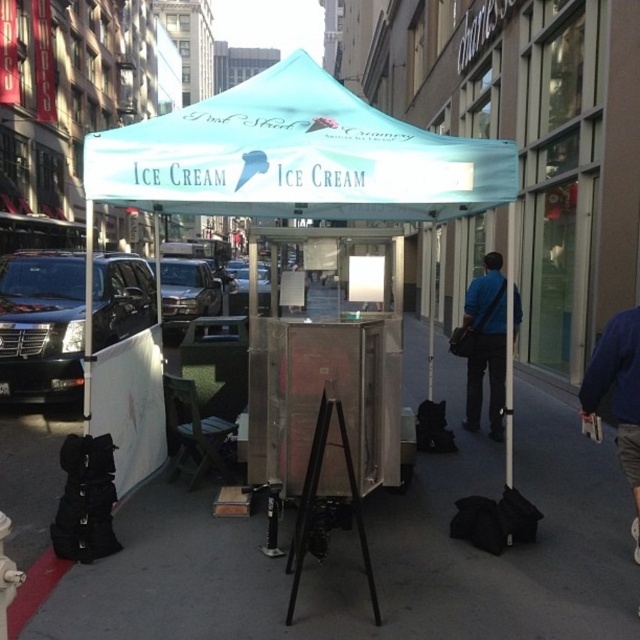
You are standing in front of the ice cream stand and want to locate both the teal fabric tent at center and the teal fabric canopy at center. According to the scene description, which one is positioned to the right of the other?

The teal fabric tent at center is positioned to the right of the teal fabric canopy at center.

You are a customer waiting in line at the Post Street Creamery. You notice two teal fabric structures at the center of the stand. One is labeled as the teal fabric tent at center and the other as the teal fabric canopy at center. From your position in the queue, which structure is positioned lower relative to the other?

The teal fabric tent at center is positioned lower than the teal fabric canopy at center because it is located below it.